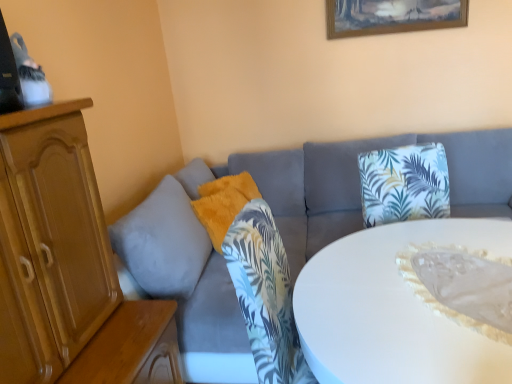
In order to face white glossy table at center, should I rotate leftwards or rightwards?

Turn right by 22.860 degrees to look at white glossy table at center.

What do you see at coordinates (284, 229) in the screenshot? I see `velvet gray couch at center` at bounding box center [284, 229].

What do you see at coordinates (223, 204) in the screenshot? I see `fuzzy orange pillow at center` at bounding box center [223, 204].

Identify the location of white glossy table at center. (393, 310).

Considering the relative positions of velvet gray couch at center and wooden picture frame at upper center in the image provided, is velvet gray couch at center behind wooden picture frame at upper center?

No, it is not.

Is point (189, 230) behind point (331, 14)?

No, (189, 230) is in front of (331, 14).

Considering the relative sizes of velvet gray couch at center and wooden picture frame at upper center in the image provided, is velvet gray couch at center taller than wooden picture frame at upper center?

Indeed, velvet gray couch at center has a greater height compared to wooden picture frame at upper center.

Can you tell me how much velvet gray couch at center and wooden picture frame at upper center differ in facing direction?

0.812 degrees.

Does fuzzy orange pillow at center have a larger size compared to velvet gray couch at center?

Incorrect, fuzzy orange pillow at center is not larger than velvet gray couch at center.

Is fuzzy orange pillow at center taller than velvet gray couch at center?

No.

From the image's perspective, which is below, fuzzy orange pillow at center or velvet gray couch at center?

velvet gray couch at center appears lower in the image.

This screenshot has width=512, height=384. What are the coordinates of `studio couch that is on the right side of fuzzy orange pillow at center` in the screenshot? It's located at (284, 229).

From a real-world perspective, is wooden picture frame at upper center positioned under fuzzy orange pillow at center based on gravity?

No, from a real-world perspective, wooden picture frame at upper center is not below fuzzy orange pillow at center.

Is wooden picture frame at upper center aimed at fuzzy orange pillow at center?

No, wooden picture frame at upper center is not oriented towards fuzzy orange pillow at center.

This screenshot has width=512, height=384. What are the coordinates of `picture frame above the fuzzy orange pillow at center (from the image's perspective)` in the screenshot? It's located at (392, 16).

Is there a large distance between wooden picture frame at upper center and fuzzy orange pillow at center?

wooden picture frame at upper center is far away from fuzzy orange pillow at center.

In terms of height, does fuzzy orange pillow at center look taller or shorter compared to wooden picture frame at upper center?

In the image, fuzzy orange pillow at center appears to be taller than wooden picture frame at upper center.

Is fuzzy orange pillow at center turned away from wooden picture frame at upper center?

No, fuzzy orange pillow at center is not facing away from wooden picture frame at upper center.

In the image, is fuzzy orange pillow at center positioned in front of or behind wooden picture frame at upper center?

fuzzy orange pillow at center is positioned closer to the viewer than wooden picture frame at upper center.

Does fuzzy orange pillow at center appear on the right side of wooden picture frame at upper center?

Incorrect, fuzzy orange pillow at center is not on the right side of wooden picture frame at upper center.

Is white glossy table at center closer to the viewer compared to fuzzy orange pillow at center?

Yes, white glossy table at center is closer to the viewer.

Is white glossy table at center beside fuzzy orange pillow at center?

white glossy table at center is not next to fuzzy orange pillow at center, and they're not touching.

From the image's perspective, is white glossy table at center over fuzzy orange pillow at center?

Actually, white glossy table at center appears below fuzzy orange pillow at center in the image.

Is point (400, 362) farther from viewer compared to point (245, 189)?

No, it is not.

From the picture: Is velvet gray couch at center situated inside fuzzy orange pillow at center or outside?

velvet gray couch at center exists outside the volume of fuzzy orange pillow at center.

The width and height of the screenshot is (512, 384). I want to click on studio couch on the right side of fuzzy orange pillow at center, so click(x=284, y=229).

Is velvet gray couch at center further to camera compared to fuzzy orange pillow at center?

No, the depth of velvet gray couch at center is less than that of fuzzy orange pillow at center.

Is wooden picture frame at upper center completely or partially outside of velvet gray couch at center?

Yes, wooden picture frame at upper center is located beyond the bounds of velvet gray couch at center.

From the image's perspective, is wooden picture frame at upper center under velvet gray couch at center?

Actually, wooden picture frame at upper center appears above velvet gray couch at center in the image.

Based on the photo, can you confirm if wooden picture frame at upper center is smaller than velvet gray couch at center?

Yes, wooden picture frame at upper center is smaller than velvet gray couch at center.

Where is `studio couch on the left of wooden picture frame at upper center`? studio couch on the left of wooden picture frame at upper center is located at coordinates (284, 229).

The height and width of the screenshot is (384, 512). Identify the location of pillow behind the velvet gray couch at center. (223, 204).

Which object lies further to the anchor point white glossy table at center, wooden picture frame at upper center or velvet gray couch at center?

Among the two, wooden picture frame at upper center is located further to white glossy table at center.

Estimate the real-world distances between objects in this image. Which object is closer to velvet gray couch at center, fuzzy orange pillow at center or white glossy table at center?

fuzzy orange pillow at center lies closer to velvet gray couch at center than the other object.

Which object lies further to the anchor point fuzzy orange pillow at center, wooden picture frame at upper center or white glossy table at center?

wooden picture frame at upper center.

Looking at the image, which one is located further to wooden picture frame at upper center, white glossy table at center or velvet gray couch at center?

The object further to wooden picture frame at upper center is white glossy table at center.

Estimate the real-world distances between objects in this image. Which object is closer to white glossy table at center, wooden picture frame at upper center or fuzzy orange pillow at center?

Among the two, fuzzy orange pillow at center is located nearer to white glossy table at center.

Looking at the image, which one is located closer to velvet gray couch at center, white glossy table at center or wooden picture frame at upper center?

Among the two, white glossy table at center is located nearer to velvet gray couch at center.

Considering their positions, is fuzzy orange pillow at center positioned closer to white glossy table at center than velvet gray couch at center?

velvet gray couch at center lies closer to white glossy table at center than the other object.

Considering their positions, is white glossy table at center positioned further to wooden picture frame at upper center than fuzzy orange pillow at center?

white glossy table at center is further to wooden picture frame at upper center.

At what (x,y) coordinates should I click in order to perform the action: click on studio couch located between white glossy table at center and fuzzy orange pillow at center in the depth direction. Please return your answer as a coordinate pair (x, y). Looking at the image, I should click on (284, 229).

The image size is (512, 384). In order to click on pillow between wooden picture frame at upper center and velvet gray couch at center in the up-down direction in this screenshot , I will do `click(223, 204)`.

In order to click on studio couch between wooden picture frame at upper center and white glossy table at center from top to bottom in this screenshot , I will do `click(284, 229)`.

The height and width of the screenshot is (384, 512). I want to click on pillow positioned between white glossy table at center and wooden picture frame at upper center from near to far, so click(x=223, y=204).